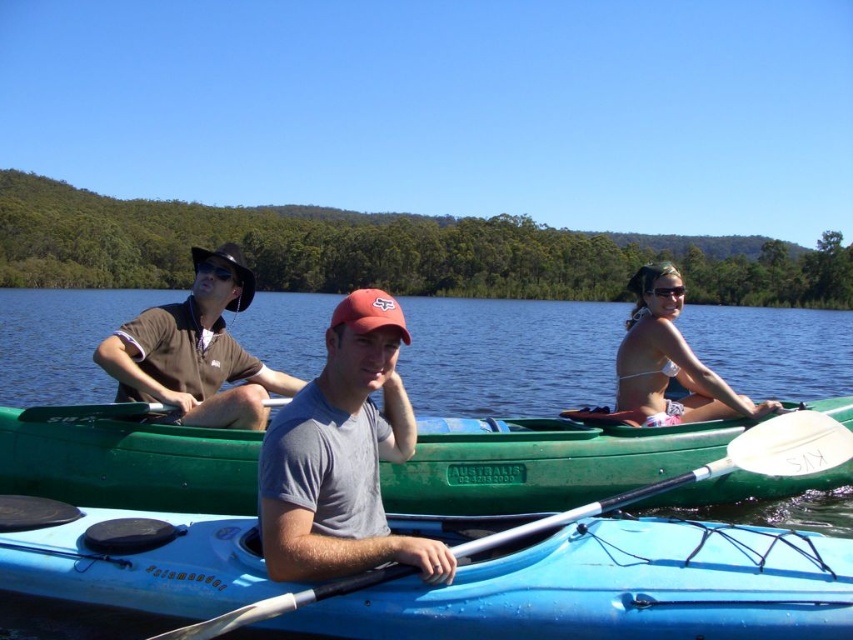
Based on the photo, you are standing on the shore of the lake and want to throw a floating ring to someone in the blue water at center. The floating ring has a diameter of 2 meters. Can you reach them with the ring if you can throw it 20 meters?

The distance between you and the blue water at center is 22.40 feet, which is approximately 6.83 meters. Since the floating ring has a diameter of 2 meters, the total reach would be 6.83 meters plus 1 meter of the ring, totaling around 7.83 meters. You can easily reach them as your throwing distance of 20 meters is more than sufficient.